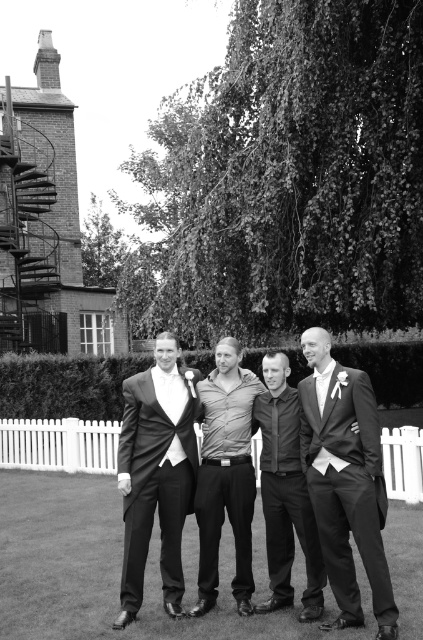
You are a photographer trying to adjust the composition of this group photo. You want to ensure that the shiny black suit at right and the smooth gray shirt at center are both visible in the frame. Based on their heights, which of the two should you position closer to the front to maintain visibility?

The shiny black suit at right is not as tall as the smooth gray shirt at center, so you should position the shiny black suit at right closer to the front to ensure both are visible.